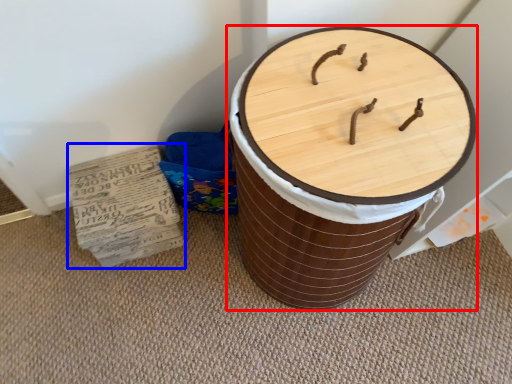
Question: Which point is closer to the camera, furniture (highlighted by a red box) or cardboard (highlighted by a blue box)?

Choices:
 (A) furniture
 (B) cardboard

Answer: (A)